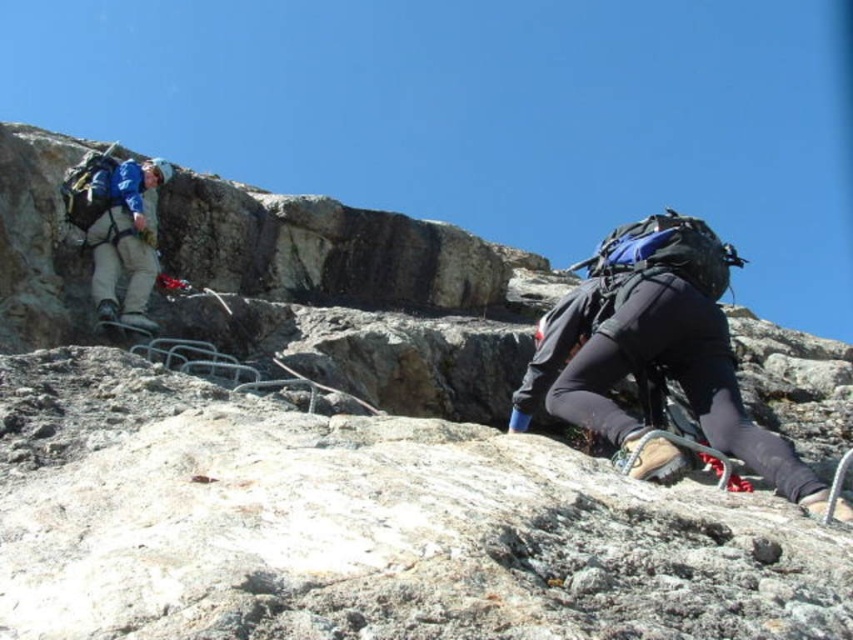
Question: Which point appears closest to the camera in this image?

Choices:
 (A) (630, 246)
 (B) (152, 196)

Answer: (A)

Question: Observing the image, what is the correct spatial positioning of matte black backpack at lower right in reference to blue fabric jacket at upper left?

Choices:
 (A) right
 (B) left

Answer: (A)

Question: Can you confirm if matte black backpack at lower right is positioned above blue fabric jacket at upper left?

Choices:
 (A) no
 (B) yes

Answer: (A)

Question: Where is matte black backpack at lower right located in relation to blue fabric jacket at upper left in the image?

Choices:
 (A) below
 (B) above

Answer: (A)

Question: Which point is closer to the camera?

Choices:
 (A) (628, 422)
 (B) (129, 268)

Answer: (A)